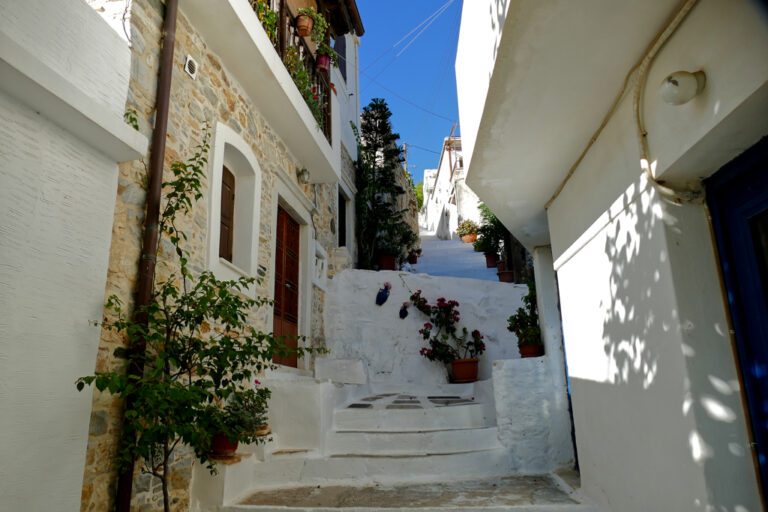
You are a GUI agent. You are given a task and a screenshot of the screen. Output one action in this format:
    pyautogui.click(x=<x>, y=<y>)
    Task: Click on the light
    
    Given the screenshot: What is the action you would take?
    (298, 170)